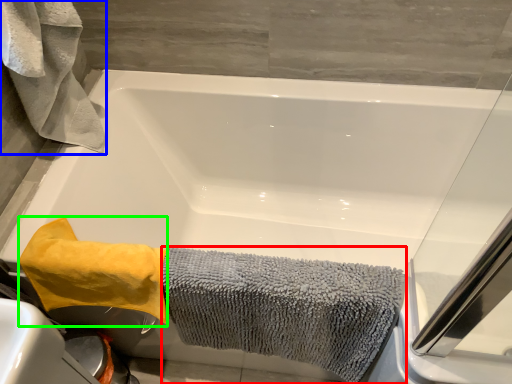
Question: Based on their relative distances, which object is nearer to bath towel (highlighted by a red box)? Choose from bath towel (highlighted by a blue box) and bath towel (highlighted by a green box).

Choices:
 (A) bath towel
 (B) bath towel

Answer: (B)